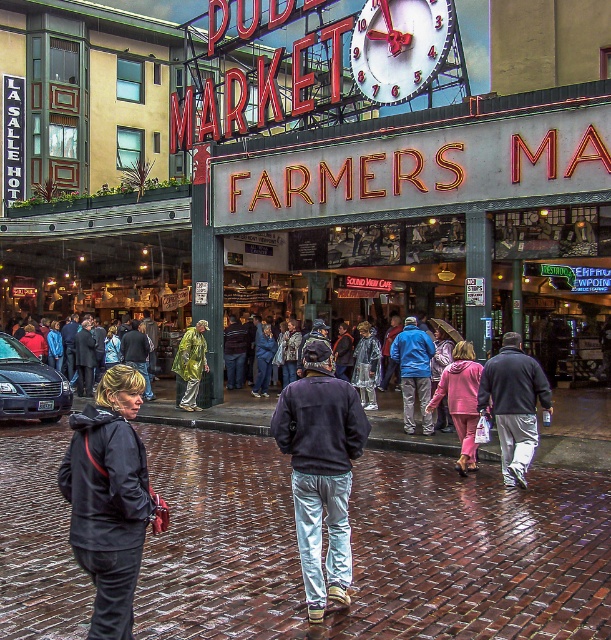
You are a photographer wanting to capture the Pike Place Market entrance while standing at the center. You have a camera with a 1.2 meter wide lens. The gray sweatpants at center and raincoat at center are blocking your view. Can both items fit within the lens width simultaneously?

The gray sweatpants at center has a larger width than the raincoat at center. Since the total width required to include both would exceed the 1.2 meter lens width, they cannot both fit within the lens simultaneously.

You are standing at the entrance of Pike Place Market and see a person wearing a dark gray jacket at lower left and another wearing a pink fleece jacket at center. Which jacket is closer to you?

The dark gray jacket at lower left is closer to you because it is positioned over the pink fleece jacket at center, indicating it is in front.

You are standing at the entrance of Pike Place Market and see both the raincoat fabric crowd at center and the clear plastic raincoat at center. Which one is nearer to you?

The raincoat fabric crowd at center is closer to the viewer than the clear plastic raincoat at center.